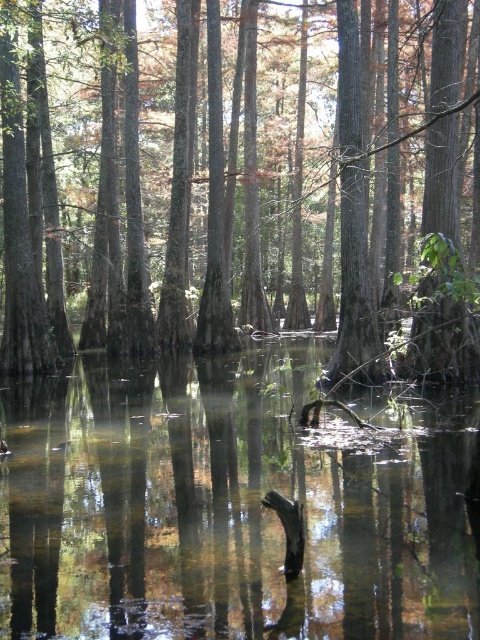
You are standing at the edge of the swamp and notice a point marked at coordinates (231,504). Based on the swamp scene described, can you determine if this point is located on the transparent water at center?

The point (231,504) is on transparent water at center, so yes, the point is located on the transparent water at center.

You are a photographer standing at the edge of the swamp, aiming to capture a photo of the transparent water at center and the smooth brown tree trunk at center. If your camera has a depth of field that can focus on objects up to 10 meters away, will both objects be in focus?

The transparent water at center is 10.01 meters away from the smooth brown tree trunk at center. Since the distance between them is just over 10 meters, the camera may struggle to keep both in focus simultaneously.